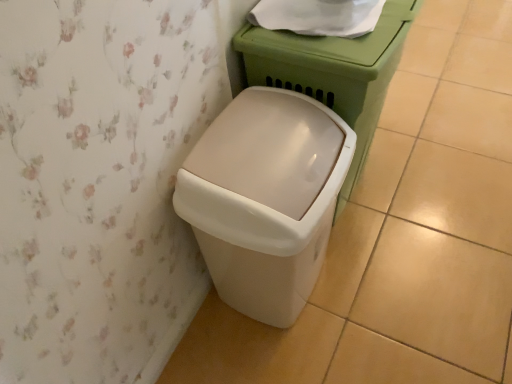
Question: Based on their sizes in the image, would you say beige plastic waste container at lower left is bigger or smaller than white paper at upper center?

Choices:
 (A) big
 (B) small

Answer: (A)

Question: Considering the relative positions of beige plastic waste container at lower left and white paper at upper center in the image provided, is beige plastic waste container at lower left to the left or to the right of white paper at upper center?

Choices:
 (A) right
 (B) left

Answer: (B)

Question: Which is nearer to the white glossy porcelain at center?

Choices:
 (A) white paper at upper center
 (B) beige plastic waste container at lower left

Answer: (A)

Question: Which of these objects is positioned closest to the beige plastic waste container at lower left?

Choices:
 (A) white glossy porcelain at center
 (B) white paper at upper center

Answer: (A)